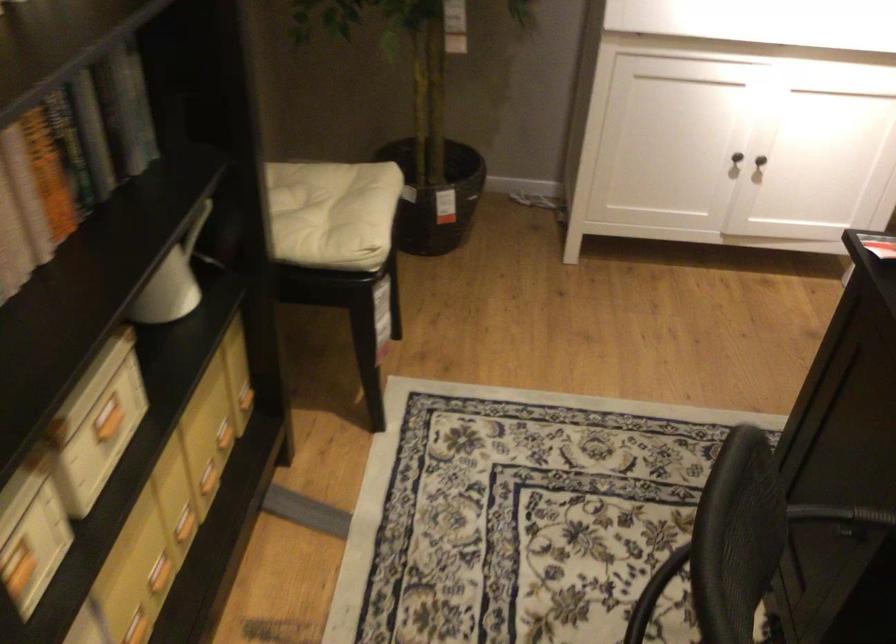
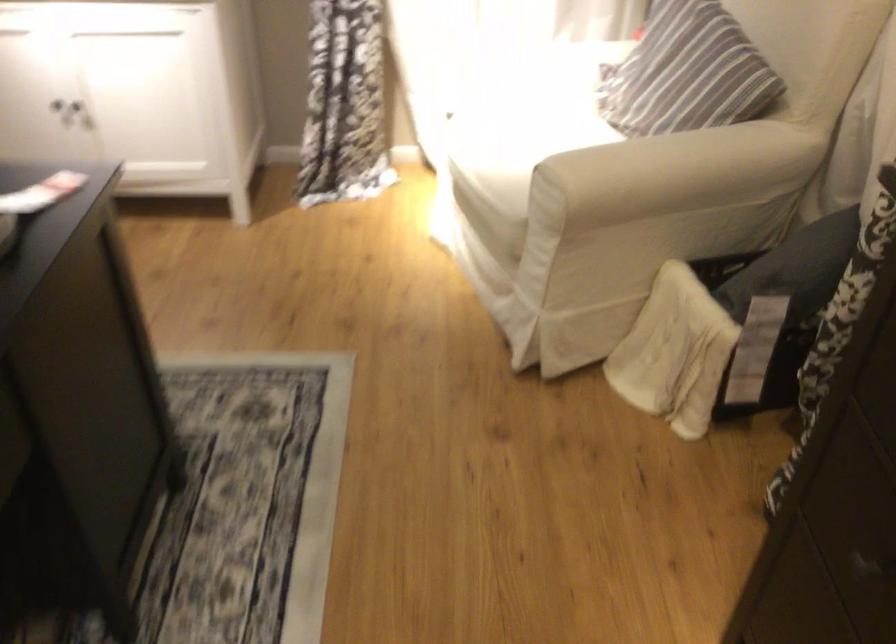
Find the pixel in the second image that matches point (755, 152) in the first image.

(67, 108)